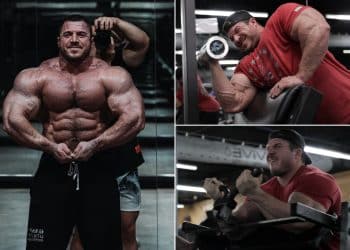
This screenshot has height=250, width=350. I want to click on ceiling lights, so click(328, 152), click(341, 15), click(260, 14), click(179, 167), click(187, 187), click(182, 207), click(346, 51).